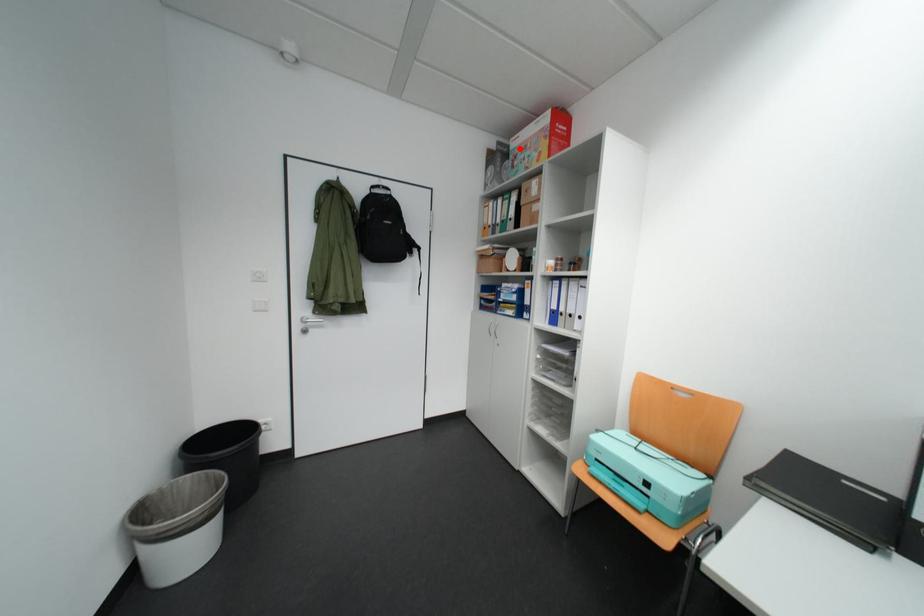
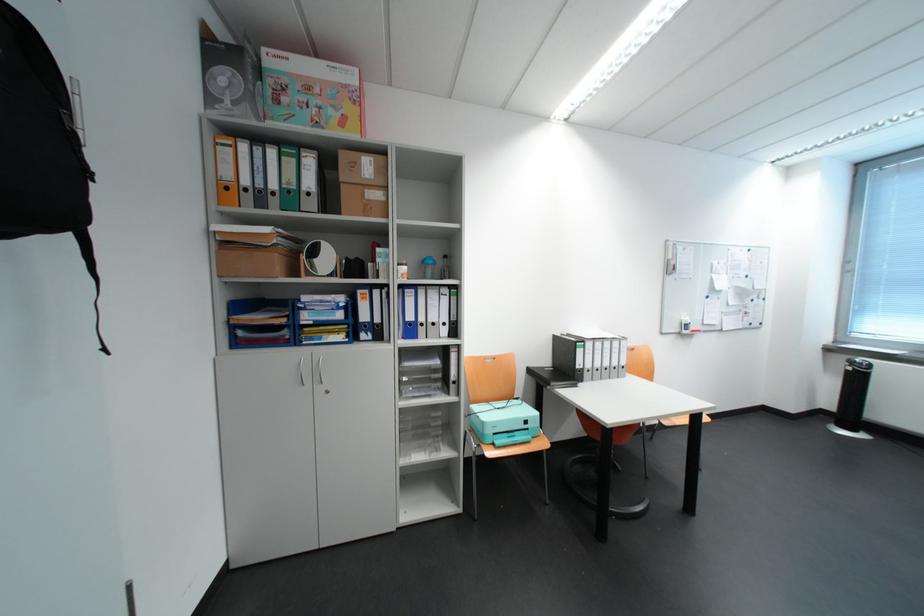
In the second image, find the point that corresponds to the highlighted location in the first image.

(272, 60)